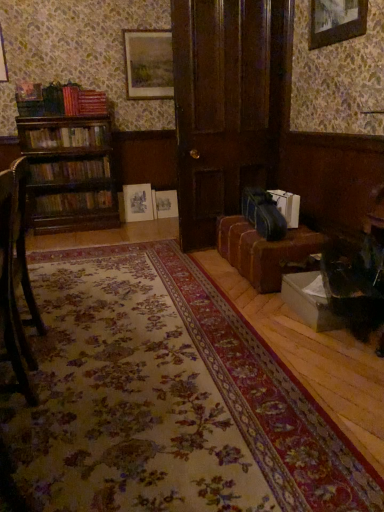
Question: In the image, is matte wooden picture frame at upper center, which appears as the 1th picture frame when viewed from the back, positioned in front of or behind wooden chair at left?

Choices:
 (A) behind
 (B) front

Answer: (A)

Question: Is matte wooden picture frame at upper center, acting as the second picture frame starting from the right, spatially inside wooden chair at left, or outside of it?

Choices:
 (A) inside
 (B) outside

Answer: (B)

Question: Based on their relative distances, which object is nearer to the hardcover books at left, which is the fourth book from bottom to top?

Choices:
 (A) wooden bookshelf at left, the third book viewed from the right
 (B) dark wood door at center
 (C) white paper bag at lower right, the 4th book from the top
 (D) wooden picture frame at upper center, the first picture frame when ordered from bottom to top
 (E) floral carpet at center

Answer: (A)

Question: Which of these objects is positioned closest to the dark wood door at center?

Choices:
 (A) hardcover book at left, which ranks as the third book in top-to-bottom order
 (B) wooden chair at left
 (C) floral carpet at center
 (D) dark blue fabric suitcase at lower right
 (E) white paper bag at lower right, which is counted as the fourth book, starting from the left

Answer: (D)